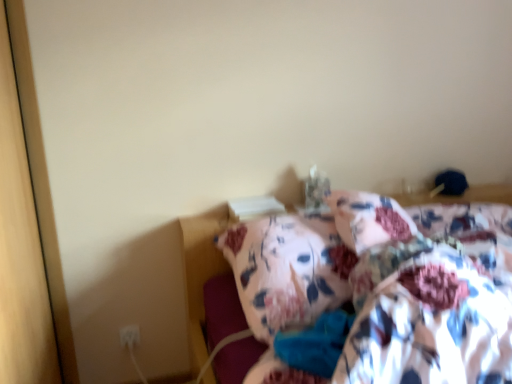
Image resolution: width=512 pixels, height=384 pixels. I want to click on floral fabric bed at center, so click(x=202, y=271).

Identify the location of floral fabric bed at center. (202, 271).

From the picture: Which is behind, floral fabric blanket at center or white plastic electric outlet at lower left?

white plastic electric outlet at lower left.

Is floral fabric blanket at center looking in the opposite direction of white plastic electric outlet at lower left?

No, floral fabric blanket at center's orientation is not away from white plastic electric outlet at lower left.

Considering the relative sizes of floral fabric blanket at center and white plastic electric outlet at lower left in the image provided, is floral fabric blanket at center wider than white plastic electric outlet at lower left?

Yes.

Is floral fabric blanket at center to the left or to the right of white plastic electric outlet at lower left in the image?

floral fabric blanket at center is positioned on white plastic electric outlet at lower left's right side.

From the image's perspective, is floral fabric bed at center under floral fabric blanket at center?

Yes, from the image's perspective, floral fabric bed at center is below floral fabric blanket at center.

Considering the sizes of objects floral fabric bed at center and floral fabric blanket at center in the image provided, who is taller, floral fabric bed at center or floral fabric blanket at center?

→ floral fabric bed at center.

Is floral fabric blanket at center a part of floral fabric bed at center?

Yes.

Is floral fabric bed at center facing towards floral fabric blanket at center?

Yes, floral fabric bed at center is turned towards floral fabric blanket at center.

Is white plastic electric outlet at lower left to the right of floral fabric bed at center from the viewer's perspective?

In fact, white plastic electric outlet at lower left is to the left of floral fabric bed at center.

Consider the image. Looking at their sizes, would you say white plastic electric outlet at lower left is wider or thinner than floral fabric bed at center?

In the image, white plastic electric outlet at lower left appears to be more narrow than floral fabric bed at center.

Are white plastic electric outlet at lower left and floral fabric bed at center beside each other?

No, white plastic electric outlet at lower left is not beside floral fabric bed at center.

Do you think white plastic electric outlet at lower left is within floral fabric blanket at center, or outside of it?

white plastic electric outlet at lower left cannot be found inside floral fabric blanket at center.

From the image's perspective, is white plastic electric outlet at lower left on floral fabric blanket at center?

No, from the image's perspective, white plastic electric outlet at lower left is not above floral fabric blanket at center.

Which is closer to the camera, (124, 327) or (444, 221)?

The point (444, 221) is more forward.

Is white plastic electric outlet at lower left positioned behind floral fabric blanket at center?

Yes, it is.

Can you confirm if floral fabric bed at center is bigger than white plastic electric outlet at lower left?

Correct, floral fabric bed at center is larger in size than white plastic electric outlet at lower left.

Does floral fabric bed at center turn towards white plastic electric outlet at lower left?

No, floral fabric bed at center is not turned towards white plastic electric outlet at lower left.

From the image's perspective, which is above, floral fabric bed at center or white plastic electric outlet at lower left?

floral fabric bed at center is shown above in the image.

Visually, is floral fabric bed at center positioned to the left or to the right of white plastic electric outlet at lower left?

Clearly, floral fabric bed at center is on the right of white plastic electric outlet at lower left in the image.

Locate an element on the screen. blanket positioned vertically above the floral fabric bed at center (from a real-world perspective) is located at coordinates (435, 302).

Considering the sizes of objects floral fabric blanket at center and floral fabric bed at center in the image provided, who is smaller, floral fabric blanket at center or floral fabric bed at center?

Smaller between the two is floral fabric blanket at center.

From a real-world perspective, which is physically above, floral fabric blanket at center or floral fabric bed at center?

floral fabric blanket at center.

Where is `blanket that appears in front of the white plastic electric outlet at lower left`? blanket that appears in front of the white plastic electric outlet at lower left is located at coordinates (435, 302).

Locate an element on the screen. The width and height of the screenshot is (512, 384). bed directly beneath the floral fabric blanket at center (from a real-world perspective) is located at coordinates (202, 271).

Based on their spatial positions, is white plastic electric outlet at lower left or floral fabric bed at center closer to floral fabric blanket at center?

The object closer to floral fabric blanket at center is floral fabric bed at center.

When comparing their distances from floral fabric blanket at center, does floral fabric bed at center or white plastic electric outlet at lower left seem closer?

floral fabric bed at center lies closer to floral fabric blanket at center than the other object.

Looking at this image, based on their spatial positions, is floral fabric bed at center or floral fabric blanket at center further from white plastic electric outlet at lower left?

Among the two, floral fabric blanket at center is located further to white plastic electric outlet at lower left.

In the scene shown: Which object lies further to the anchor point floral fabric bed at center, white plastic electric outlet at lower left or floral fabric blanket at center?

Based on the image, floral fabric blanket at center appears to be further to floral fabric bed at center.

When comparing their distances from floral fabric bed at center, does floral fabric blanket at center or white plastic electric outlet at lower left seem closer?

white plastic electric outlet at lower left.

Estimate the real-world distances between objects in this image. Which object is further from white plastic electric outlet at lower left, floral fabric blanket at center or floral fabric bed at center?

Among the two, floral fabric blanket at center is located further to white plastic electric outlet at lower left.

Image resolution: width=512 pixels, height=384 pixels. I want to click on blanket between floral fabric bed at center and white plastic electric outlet at lower left in the front-back direction, so click(x=435, y=302).